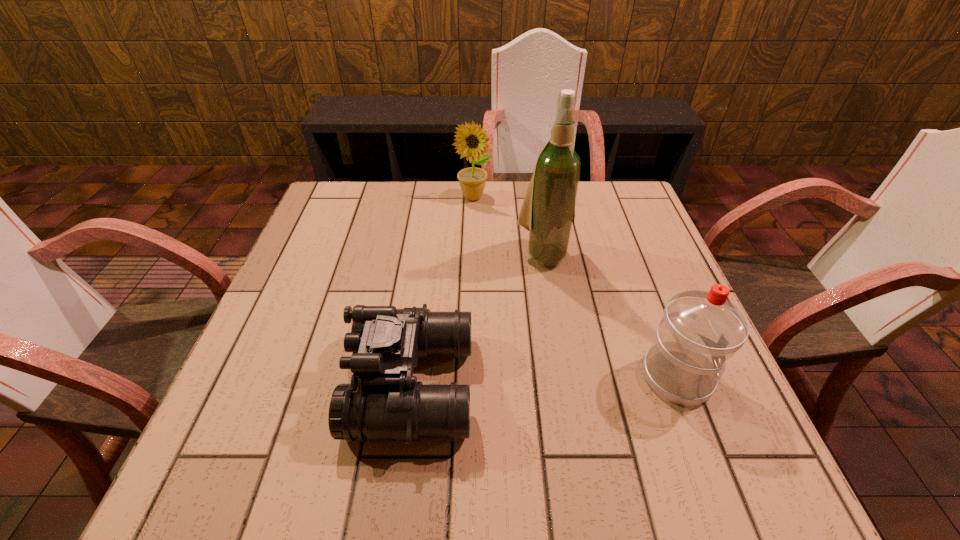
In order to click on the shortest object in this screenshot , I will do (384, 402).

Locate an element on the screen. Image resolution: width=960 pixels, height=540 pixels. the rightmost object is located at coordinates (700, 330).

The image size is (960, 540). What are the coordinates of `the farthest object` in the screenshot? It's located at (471, 140).

Where is `the third nearest object`? This screenshot has height=540, width=960. the third nearest object is located at coordinates (548, 210).

Where is `wine bottle`? wine bottle is located at coordinates (548, 210).

This screenshot has height=540, width=960. In order to click on free spot located through the lenses of the shortest object in this screenshot , I will do `click(310, 384)`.

Where is `vacant space situated through the lenses of the shortest object`? vacant space situated through the lenses of the shortest object is located at coordinates (305, 384).

Where is `vacant area situated through the lenses of the shortest object`? This screenshot has height=540, width=960. vacant area situated through the lenses of the shortest object is located at coordinates (236, 384).

The height and width of the screenshot is (540, 960). Identify the location of vacant space located 0.220m on the face of the sunflower. (506, 251).

This screenshot has height=540, width=960. Identify the location of free region located on the face of the sunflower. (515, 266).